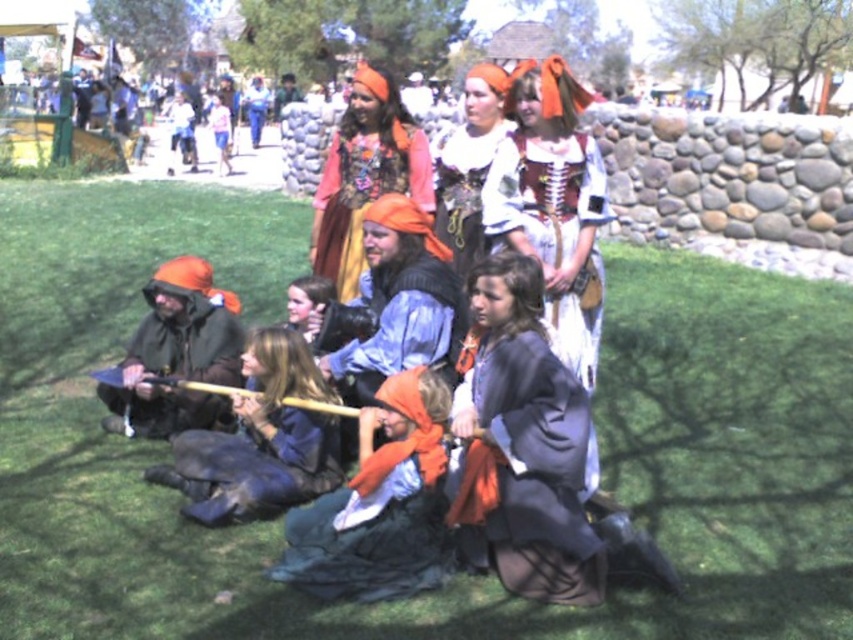
You are a medieval knight standing at the edge of the green grass at center and the orange fabric hood at center. You need to place a shield that is 1.2 meters wide between them. Will the shield fit between the two objects?

The distance between the green grass at center and orange fabric hood at center is 1.13 meters. Since the shield is 1.2 meters wide, it will not fit between them as the space is narrower than the shield.

You are a participant in the medieval festival standing at the edge of the grassy area. You want to place a 10 feet long banner between the green grass at center and the floral fabric dress at center. Is there enough space between them to fit the banner horizontally?

The distance between the green grass at center and the floral fabric dress at center is 9.22 feet. Since the banner is 10 feet long, it would not fit horizontally between them as the space is shorter than the banner.

From the picture: You are standing at the point with coordinates point (412, 435) and want to walk towards the point with coordinates point (677, 618). Which direction should you move?

You should move forward because point (677, 618) is in front of point (412, 435).